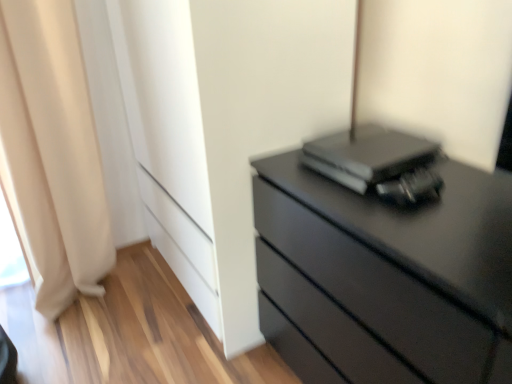
Question: Is black matte computer at upper right further to camera compared to matte black chest of drawers at right?

Choices:
 (A) yes
 (B) no

Answer: (A)

Question: Can you confirm if black matte computer at upper right is smaller than matte black chest of drawers at right?

Choices:
 (A) yes
 (B) no

Answer: (A)

Question: Is black matte computer at upper right positioned in front of matte black chest of drawers at right?

Choices:
 (A) yes
 (B) no

Answer: (B)

Question: Can you confirm if black matte computer at upper right is thinner than matte black chest of drawers at right?

Choices:
 (A) yes
 (B) no

Answer: (A)

Question: From the image's perspective, would you say black matte computer at upper right is positioned over matte black chest of drawers at right?

Choices:
 (A) no
 (B) yes

Answer: (B)

Question: Can we say black matte computer at upper right lies outside matte black chest of drawers at right?

Choices:
 (A) no
 (B) yes

Answer: (B)

Question: Can you confirm if matte black chest of drawers at right is smaller than black matte computer at upper right?

Choices:
 (A) no
 (B) yes

Answer: (A)

Question: From a real-world perspective, does matte black chest of drawers at right sit lower than black matte computer at upper right?

Choices:
 (A) no
 (B) yes

Answer: (B)

Question: Is the surface of matte black chest of drawers at right in direct contact with black matte computer at upper right?

Choices:
 (A) no
 (B) yes

Answer: (A)

Question: Can you confirm if matte black chest of drawers at right is bigger than black matte computer at upper right?

Choices:
 (A) yes
 (B) no

Answer: (A)

Question: Does matte black chest of drawers at right appear on the right side of black matte computer at upper right?

Choices:
 (A) yes
 (B) no

Answer: (A)

Question: Does matte black chest of drawers at right appear on the left side of black matte computer at upper right?

Choices:
 (A) yes
 (B) no

Answer: (B)

Question: Is beige fabric curtain at left outside of black matte computer at upper right?

Choices:
 (A) no
 (B) yes

Answer: (B)